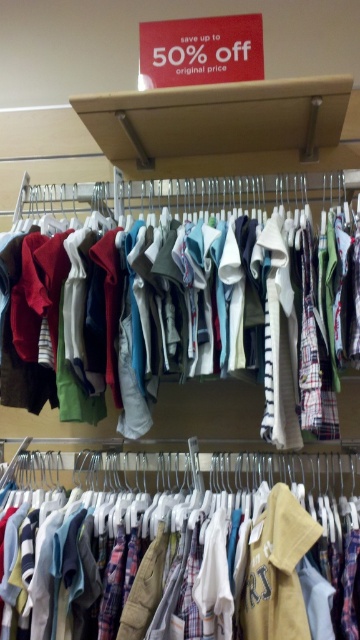
Question: Does plaid fabric shirts at center come behind matte cotton shorts at center?

Choices:
 (A) yes
 (B) no

Answer: (B)

Question: In this image, where is plaid fabric shirts at center located relative to matte cotton shorts at center?

Choices:
 (A) above
 (B) below

Answer: (B)

Question: Which point is closer to the camera?

Choices:
 (A) (125, 630)
 (B) (344, 388)

Answer: (A)

Question: Is plaid fabric shirts at center thinner than matte cotton shorts at center?

Choices:
 (A) no
 (B) yes

Answer: (A)